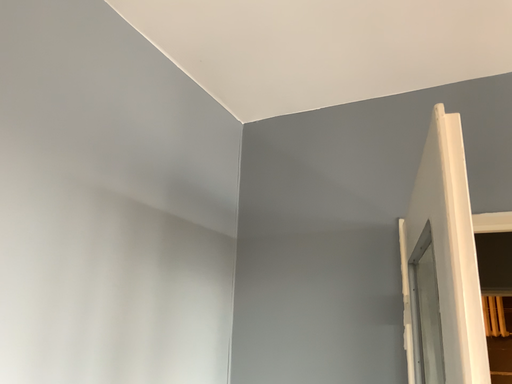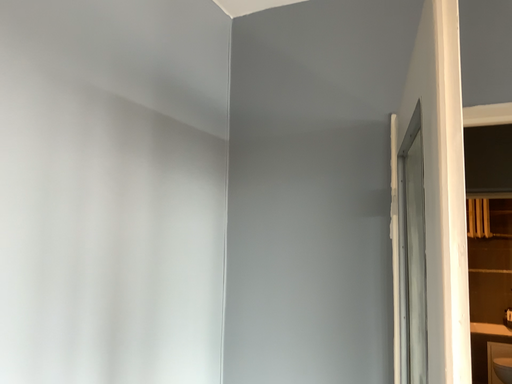
Question: How did the camera likely rotate when shooting the video?

Choices:
 (A) rotated upward
 (B) rotated downward

Answer: (B)